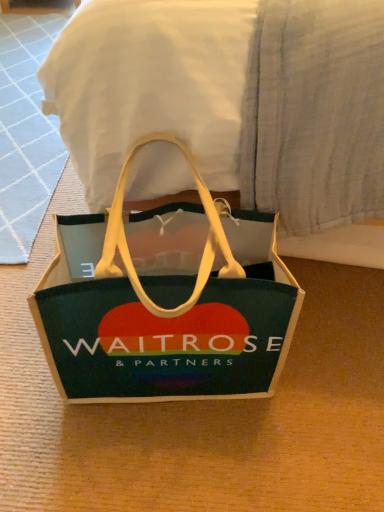
Question: Is green felt bag at center far away from white fabric at center?

Choices:
 (A) yes
 (B) no

Answer: (B)

Question: Is green felt bag at center oriented away from white fabric at center?

Choices:
 (A) yes
 (B) no

Answer: (B)

Question: From the image's perspective, is green felt bag at center on top of white fabric at center?

Choices:
 (A) no
 (B) yes

Answer: (A)

Question: From a real-world perspective, is green felt bag at center physically above white fabric at center?

Choices:
 (A) yes
 (B) no

Answer: (B)

Question: Is green felt bag at center directly adjacent to white fabric at center?

Choices:
 (A) no
 (B) yes

Answer: (A)

Question: Is white fabric at center surrounded by green felt bag at center?

Choices:
 (A) no
 (B) yes

Answer: (A)

Question: From the image's perspective, is white fabric at center beneath green felt bag at center?

Choices:
 (A) no
 (B) yes

Answer: (A)

Question: Can you confirm if white fabric at center is positioned to the right of green felt bag at center?

Choices:
 (A) no
 (B) yes

Answer: (B)

Question: Is white fabric at center facing towards green felt bag at center?

Choices:
 (A) yes
 (B) no

Answer: (B)

Question: Would you say white fabric at center is a long distance from green felt bag at center?

Choices:
 (A) no
 (B) yes

Answer: (A)

Question: Would you say white fabric at center contains green felt bag at center?

Choices:
 (A) no
 (B) yes

Answer: (A)

Question: From a real-world perspective, is white fabric at center positioned over green felt bag at center based on gravity?

Choices:
 (A) yes
 (B) no

Answer: (A)

Question: Is white fabric at center taller or shorter than green felt bag at center?

Choices:
 (A) short
 (B) tall

Answer: (B)